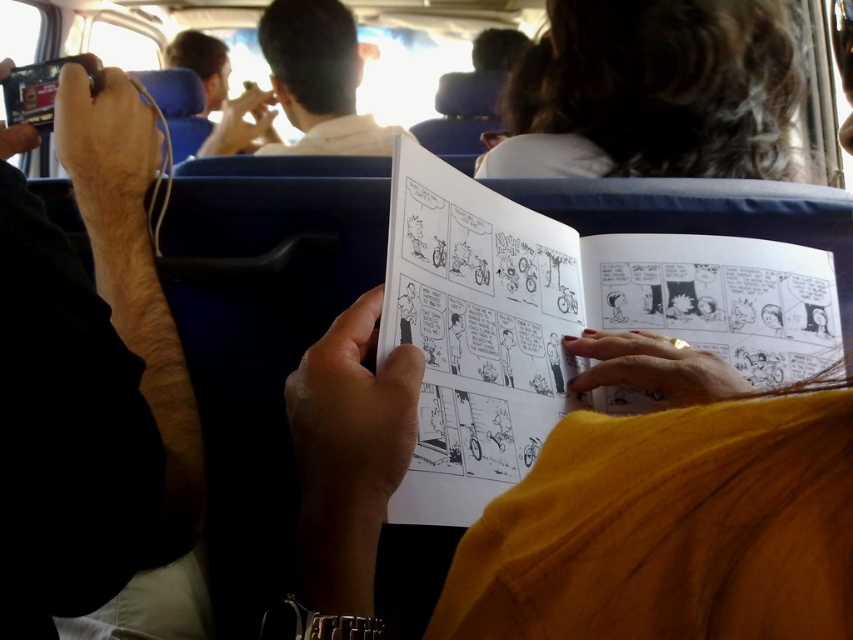
You are a passenger on a bus and you see a black paper comic book at center and a black plastic phone at left. Which object is shorter in height?

The black paper comic book at center is shorter in height compared to the black plastic phone at left.

Looking at this image, you are a passenger on a bus and you have a black plastic phone at left and a black paper comic book at center. You want to place both items on the seat next to you. However, the seat has limited space. Which item should you place closer to the edge of the seat to prevent it from falling off?

The black plastic phone at left should be placed closer to the edge of the seat because it is behind the black paper comic book at center, meaning it is smaller and less likely to tip over.

You are a passenger on a bus and see the black paper comic book at center and the light brown hair at upper center. Which object is closer to the ceiling?

The light brown hair at upper center is closer to the ceiling because it is above the black paper comic book at center.